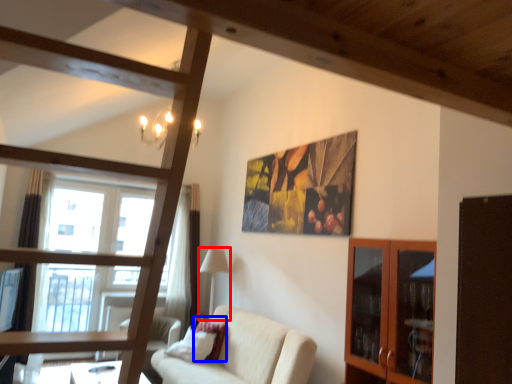
Question: Which object is further to the camera taking this photo, lamp (highlighted by a red box) or pillow (highlighted by a blue box)?

Choices:
 (A) lamp
 (B) pillow

Answer: (A)